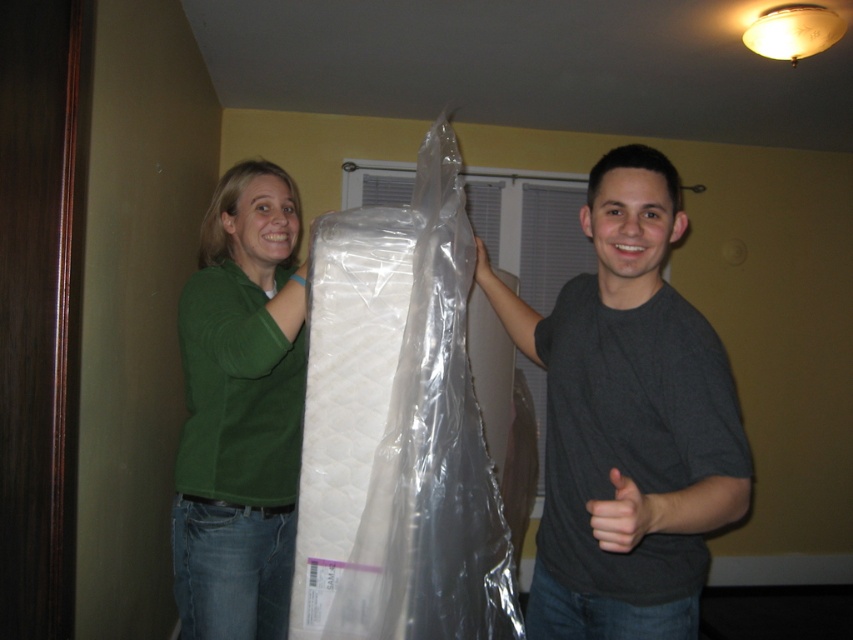
You are a delivery person who needs to lift the mattress from the point at the bottom of the mattress labeled SAM S CLUB. The point is at coordinates point (x=357, y=620). If your arm can reach 1.2 meters, can you reach that point?

The distance of point (x=357, y=620) from the camera is 1.17 meters, so yes, the delivery person can reach the point since their arm can reach 1.2 meters which is longer than the distance.

You are helping move a mattress and see the clear plastic mattress at center and the green matte shirt at center. Which object is positioned to the right side?

The clear plastic mattress at center is to the right of the green matte shirt at center.